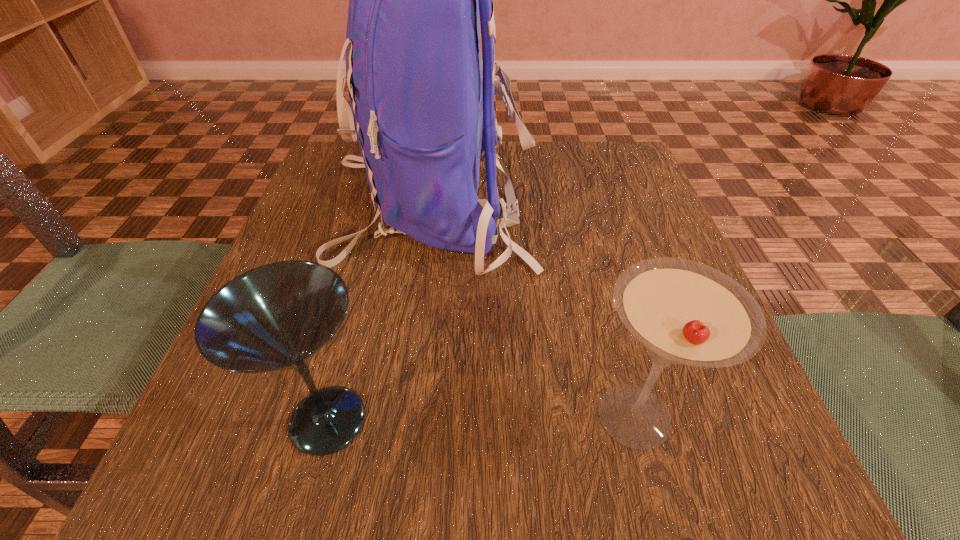
Locate which object is the second closest to the right martini. Please provide its 2D coordinates. Your answer should be formatted as a tuple, i.e. [(x, y)], where the tuple contains the x and y coordinates of a point satisfying the conditions above.

[(277, 316)]

This screenshot has width=960, height=540. I want to click on free region that satisfies the following two spatial constraints: 1. on the back side of the rightmost object; 2. on the back of the farthest object, so tap(579, 205).

Find the location of a particular element. The image size is (960, 540). free region that satisfies the following two spatial constraints: 1. on the back of the backpack; 2. on the left side of the rightmost object is located at coordinates (403, 415).

Where is `free space that satisfies the following two spatial constraints: 1. on the back side of the left martini; 2. on the left side of the right martini`? This screenshot has height=540, width=960. free space that satisfies the following two spatial constraints: 1. on the back side of the left martini; 2. on the left side of the right martini is located at coordinates (329, 415).

Image resolution: width=960 pixels, height=540 pixels. I want to click on free spot that satisfies the following two spatial constraints: 1. on the back of the right martini; 2. on the left side of the farthest object, so click(x=403, y=415).

Locate an element on the screen. The height and width of the screenshot is (540, 960). free space that satisfies the following two spatial constraints: 1. on the back of the rightmost object; 2. on the left side of the farthest object is located at coordinates (403, 415).